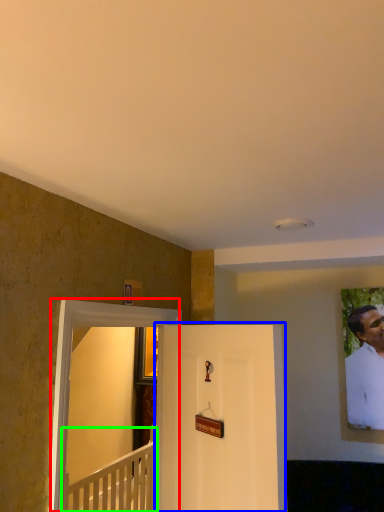
Question: Considering the real-world distances, which object is farthest from glass door (highlighted by a red box)? door (highlighted by a blue box) or furniture (highlighted by a green box)?

Choices:
 (A) door
 (B) furniture

Answer: (B)